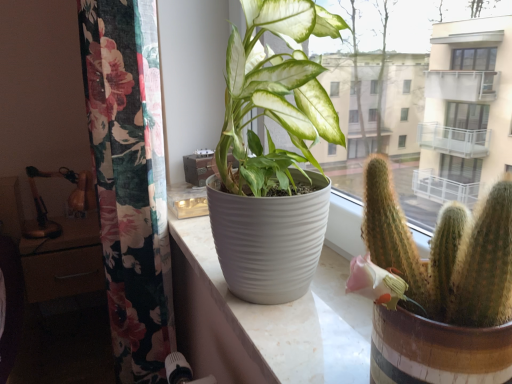
Question: Relative to white ribbed pot at center, is matte brown drawer at left in front or behind?

Choices:
 (A) front
 (B) behind

Answer: (B)

Question: From a real-world perspective, is matte brown drawer at left above or below white ribbed pot at center?

Choices:
 (A) below
 (B) above

Answer: (A)

Question: Which object is the farthest from the white ribbed pot at center?

Choices:
 (A) green spiky cactus at right
 (B) matte brown drawer at left
 (C) floral fabric curtain at left

Answer: (B)

Question: Which is farther from the floral fabric curtain at left?

Choices:
 (A) matte brown drawer at left
 (B) white ribbed pot at center
 (C) green spiky cactus at right

Answer: (A)